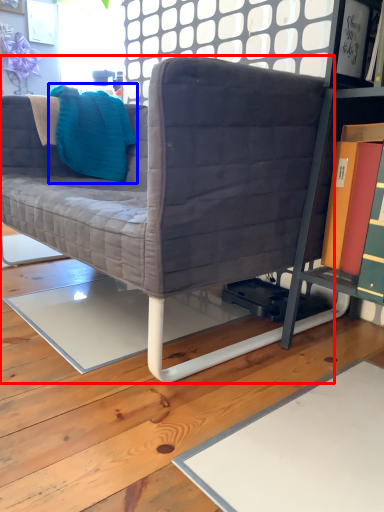
Question: Which object appears farthest to the camera in this image, studio couch (highlighted by a red box) or throw pillow (highlighted by a blue box)?

Choices:
 (A) studio couch
 (B) throw pillow

Answer: (B)